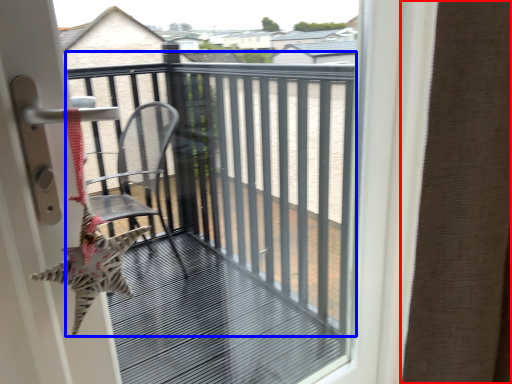
Question: Which point is further to the camera, curtain (highlighted by a red box) or balcony (highlighted by a blue box)?

Choices:
 (A) curtain
 (B) balcony

Answer: (B)